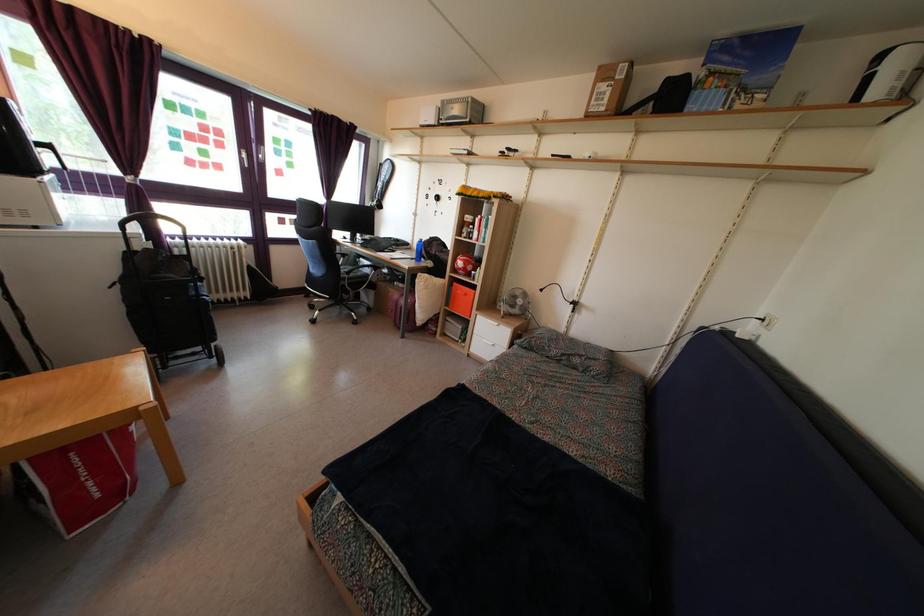
Where is `black trolley handle`? This screenshot has width=924, height=616. black trolley handle is located at coordinates [x=152, y=233].